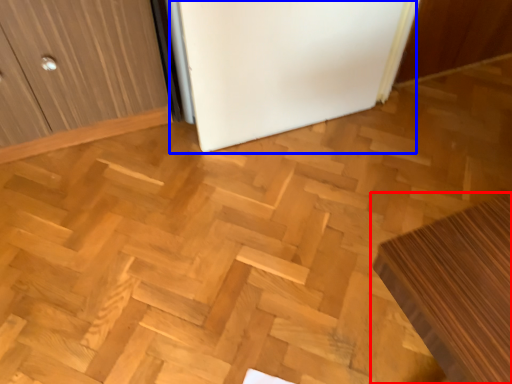
Question: Which of the following is the closest to the observer, furniture (highlighted by a red box) or fridge (highlighted by a blue box)?

Choices:
 (A) furniture
 (B) fridge

Answer: (A)